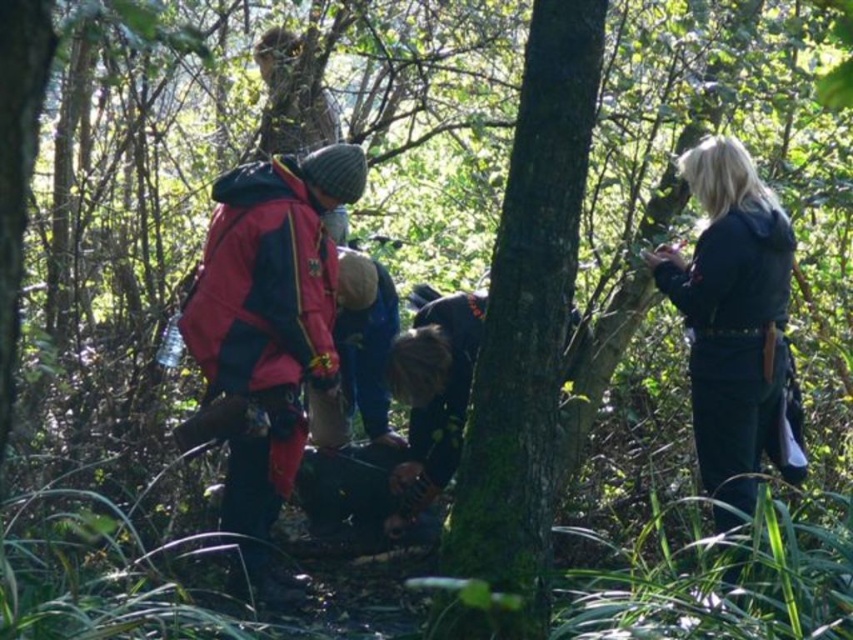
Is red fabric jacket at center above black matte jacket at right?

No, red fabric jacket at center is not above black matte jacket at right.

Looking at this image, can you confirm if red fabric jacket at center is thinner than black matte jacket at right?

No, red fabric jacket at center is not thinner than black matte jacket at right.

Locate an element on the screen. The height and width of the screenshot is (640, 853). red fabric jacket at center is located at coordinates (265, 333).

Is green mossy tree at center above black matte jacket at right?

Correct, green mossy tree at center is located above black matte jacket at right.

Describe the element at coordinates (524, 333) in the screenshot. This screenshot has height=640, width=853. I see `green mossy tree at center` at that location.

Image resolution: width=853 pixels, height=640 pixels. Describe the element at coordinates (524, 333) in the screenshot. I see `green mossy tree at center` at that location.

You are a GUI agent. You are given a task and a screenshot of the screen. Output one action in this format:
    pyautogui.click(x=<x>, y=<y>)
    Task: Click on the green mossy tree at center
    The height and width of the screenshot is (640, 853).
    Given the screenshot: What is the action you would take?
    pyautogui.click(x=524, y=333)

Between green mossy tree at center and red fabric jacket at center, which one is positioned higher?

green mossy tree at center

Can you confirm if green mossy tree at center is shorter than red fabric jacket at center?

Incorrect, green mossy tree at center's height does not fall short of red fabric jacket at center's.

Locate an element on the screen. Image resolution: width=853 pixels, height=640 pixels. green mossy tree at center is located at coordinates (524, 333).